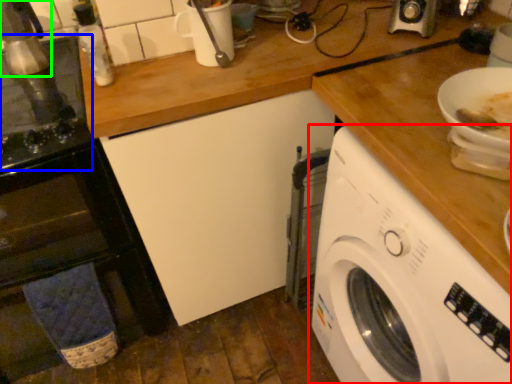
Question: Which object is positioned farthest from washing machine (highlighted by a red box)? Select from appliance (highlighted by a blue box) and appliance (highlighted by a green box).

Choices:
 (A) appliance
 (B) appliance

Answer: (B)